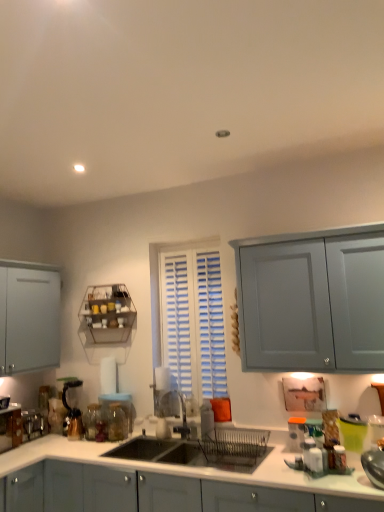
Question: From the image's perspective, is transparent glass jar at sink, the 1th glass jar viewed from the right, on top of metallic wire rack at upper left?

Choices:
 (A) yes
 (B) no

Answer: (B)

Question: Is transparent glass jar at sink, the 1th glass jar viewed from the right, further to camera compared to metallic wire rack at upper left?

Choices:
 (A) no
 (B) yes

Answer: (A)

Question: Is transparent glass jar at sink, the 1th glass jar viewed from the right, far away from metallic wire rack at upper left?

Choices:
 (A) no
 (B) yes

Answer: (A)

Question: From a real-world perspective, is transparent glass jar at sink, the second glass jar positioned from the left, located higher than metallic wire rack at upper left?

Choices:
 (A) yes
 (B) no

Answer: (B)

Question: Considering the relative sizes of transparent glass jar at sink, the second glass jar positioned from the left, and metallic wire rack at upper left in the image provided, is transparent glass jar at sink, the second glass jar positioned from the left, shorter than metallic wire rack at upper left?

Choices:
 (A) yes
 (B) no

Answer: (A)

Question: From the image's perspective, is matte black coffee machine at lower left above or below transparent glass jar at lower left, the second glass jar viewed from the right?

Choices:
 (A) below
 (B) above

Answer: (B)

Question: In terms of height, does matte black coffee machine at lower left look taller or shorter compared to transparent glass jar at lower left, the second glass jar viewed from the right?

Choices:
 (A) tall
 (B) short

Answer: (A)

Question: Do you think matte black coffee machine at lower left is within transparent glass jar at lower left, the second glass jar viewed from the right, or outside of it?

Choices:
 (A) outside
 (B) inside

Answer: (A)

Question: From a real-world perspective, is matte black coffee machine at lower left above or below transparent glass jar at lower left, which appears as the first glass jar when viewed from the left?

Choices:
 (A) below
 (B) above

Answer: (B)

Question: From a real-world perspective, is metallic silver toaster at lower left, which is the 3th appliance in right-to-left order, physically located above or below matte gray cabinets at center?

Choices:
 (A) below
 (B) above

Answer: (B)

Question: Is metallic silver toaster at lower left, which is the 1th appliance in left-to-right order, in front of or behind matte gray cabinets at center in the image?

Choices:
 (A) behind
 (B) front

Answer: (A)

Question: From the image's perspective, is metallic silver toaster at lower left, the third appliance positioned from the front, positioned above or below matte gray cabinets at center?

Choices:
 (A) below
 (B) above

Answer: (B)

Question: Choose the correct answer: Is metallic silver toaster at lower left, which appears as the 1th appliance when viewed from the back, inside matte gray cabinets at center or outside it?

Choices:
 (A) inside
 (B) outside

Answer: (B)

Question: Is matte black coffee machine at lower left inside or outside of matte plastic container at right, the 2th appliance when ordered from front to back?

Choices:
 (A) inside
 (B) outside

Answer: (B)

Question: From the image's perspective, relative to matte plastic container at right, positioned as the 1th appliance in right-to-left order, is matte black coffee machine at lower left above or below?

Choices:
 (A) below
 (B) above

Answer: (A)